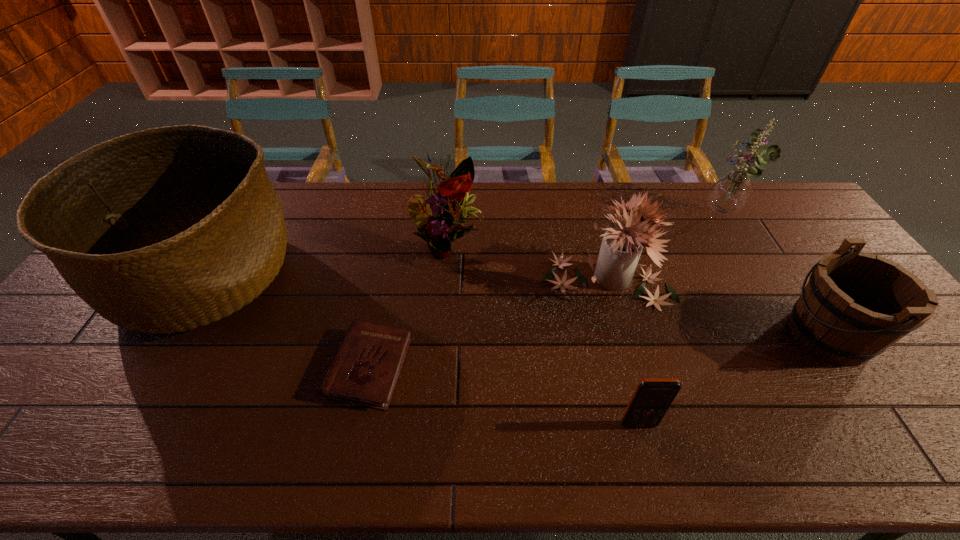
Identify the location of free space between the second bouquet from right to left and the nearest object. The height and width of the screenshot is (540, 960). (622, 353).

Find the location of a particular element. empty space between the basket and the rightmost bouquet is located at coordinates (464, 246).

Identify the location of free space between the rightmost bouquet and the second bouquet from left to right. The height and width of the screenshot is (540, 960). (664, 248).

Where is `free space that is in between the rightmost bouquet and the leftmost object`? The height and width of the screenshot is (540, 960). free space that is in between the rightmost bouquet and the leftmost object is located at coordinates (464, 246).

You are a GUI agent. You are given a task and a screenshot of the screen. Output one action in this format:
    pyautogui.click(x=<x>, y=<y>)
    Task: Click on the free space between the fifth tallest object and the second bouquet from left to right
    Image resolution: width=960 pixels, height=540 pixels.
    Given the screenshot: What is the action you would take?
    pyautogui.click(x=717, y=308)

Where is `vacant area that lies between the hardback book and the second bouquet from left to right`? This screenshot has width=960, height=540. vacant area that lies between the hardback book and the second bouquet from left to right is located at coordinates (488, 325).

Where is `free space that is in between the basket and the leftmost bouquet`? This screenshot has width=960, height=540. free space that is in between the basket and the leftmost bouquet is located at coordinates (325, 261).

Where is `free space between the second bouquet from left to right and the hardback book`? free space between the second bouquet from left to right and the hardback book is located at coordinates (488, 325).

Choose which object is the fifth nearest neighbor to the nearest object. Please provide its 2D coordinates. Your answer should be formatted as a tuple, i.e. [(x, y)], where the tuple contains the x and y coordinates of a point satisfying the conditions above.

[(730, 192)]

Locate which object ranks sixth in proximity to the cellular telephone. Please provide its 2D coordinates. Your answer should be formatted as a tuple, i.e. [(x, y)], where the tuple contains the x and y coordinates of a point satisfying the conditions above.

[(171, 228)]